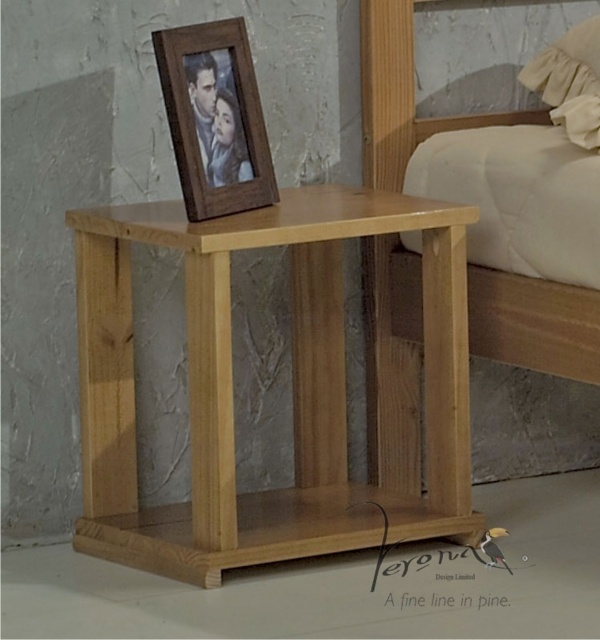
Does natural wood side table at center lie in front of natural wood bed at center?

That is True.

Between natural wood side table at center and natural wood bed at center, which one has more height?

natural wood bed at center is taller.

This screenshot has width=600, height=640. What do you see at coordinates (292, 384) in the screenshot?
I see `natural wood side table at center` at bounding box center [292, 384].

Where is `natural wood side table at center`? natural wood side table at center is located at coordinates (292, 384).

Between natural wood side table at center and wooden photo frame at upper center, which one is positioned higher?

Positioned higher is wooden photo frame at upper center.

Based on the photo, who is more forward, (349, 531) or (231, 24)?

Point (231, 24)

Locate an element on the screen. The width and height of the screenshot is (600, 640). natural wood side table at center is located at coordinates (292, 384).

The height and width of the screenshot is (640, 600). In order to click on wooden photo frame at upper center in this screenshot , I will do `click(214, 118)`.

Which of these two, wooden photo frame at upper center or beige fabric pillow at upper right, stands taller?

Standing taller between the two is wooden photo frame at upper center.

I want to click on wooden photo frame at upper center, so click(x=214, y=118).